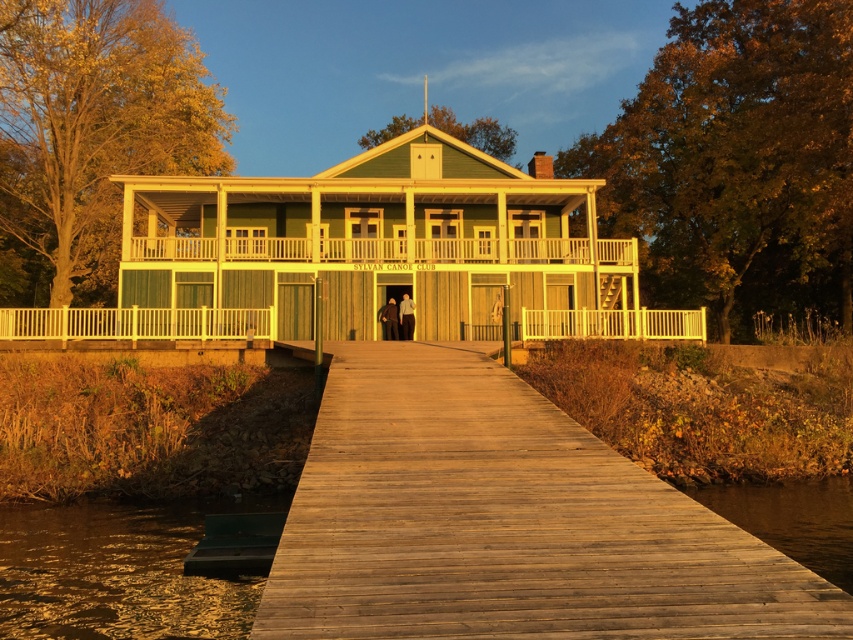
Based on the photo, you are standing at the SYLVAN CANOE CLUB and want to get to the wooden porch at center. Which direction should you move to reach it from the green wood water at lower left?

The green wood water at lower left is closer to the viewer than the wooden porch at center, so you should move towards the center to reach the wooden porch at center from the green wood water at lower left.

You are standing at the entrance of the SYLVAN CANOE CLUB and need to reach the wooden porch at center. According to the coordinates provided, what direction should you move relative to the entrance?

The wooden porch at center is located at coordinates point (415, 250), so you should move towards the center of the image from the entrance to reach it.